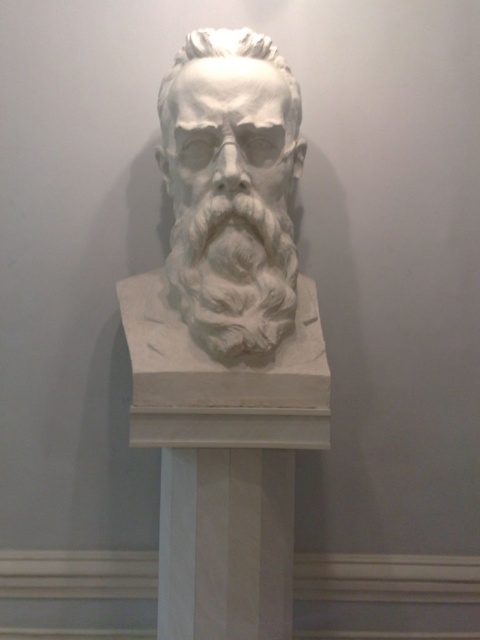
Question: Which of the following is the farthest from the observer?

Choices:
 (A) white marble bust at center
 (B) white stone beard at center

Answer: (B)

Question: Is white marble pedestal at center positioned at the back of white stone beard at center?

Choices:
 (A) no
 (B) yes

Answer: (B)

Question: Estimate the real-world distances between objects in this image. Which object is closer to the white marble bust at center?

Choices:
 (A) white marble pedestal at center
 (B) white stone beard at center

Answer: (B)

Question: Is white marble bust at center behind white stone beard at center?

Choices:
 (A) no
 (B) yes

Answer: (A)

Question: Which point is farther to the camera?

Choices:
 (A) white marble pedestal at center
 (B) white marble bust at center
 (C) white stone beard at center

Answer: (A)

Question: Can you confirm if white marble pedestal at center is positioned to the right of white stone beard at center?

Choices:
 (A) yes
 (B) no

Answer: (B)